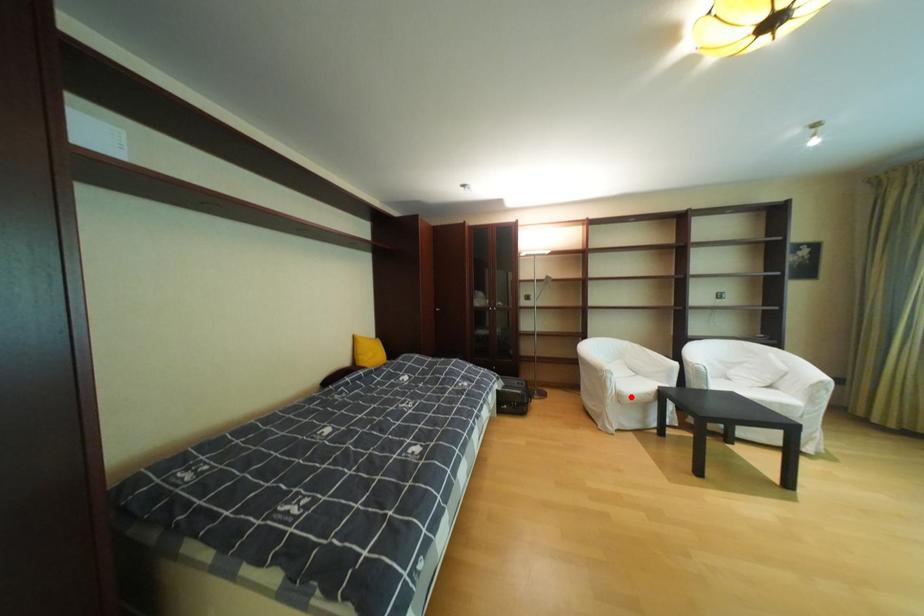
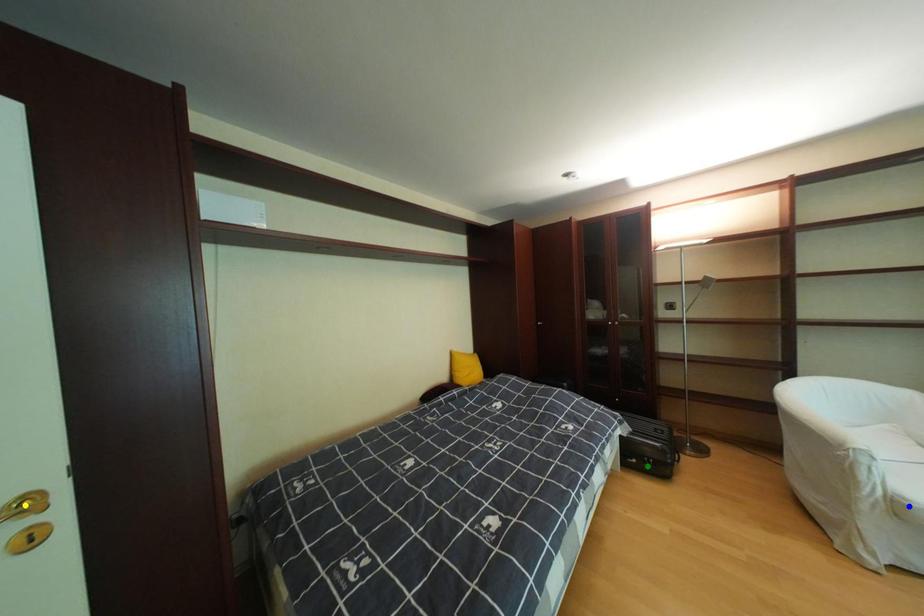
Question: I am providing you with two images of the same scene from different viewpoints. A red point is marked on the first image. You are given multiple points on the second image. Can you choose the point in image 2 that corresponds to the point in image 1?

Choices:
 (A) green point
 (B) blue point
 (C) yellow point

Answer: (B)